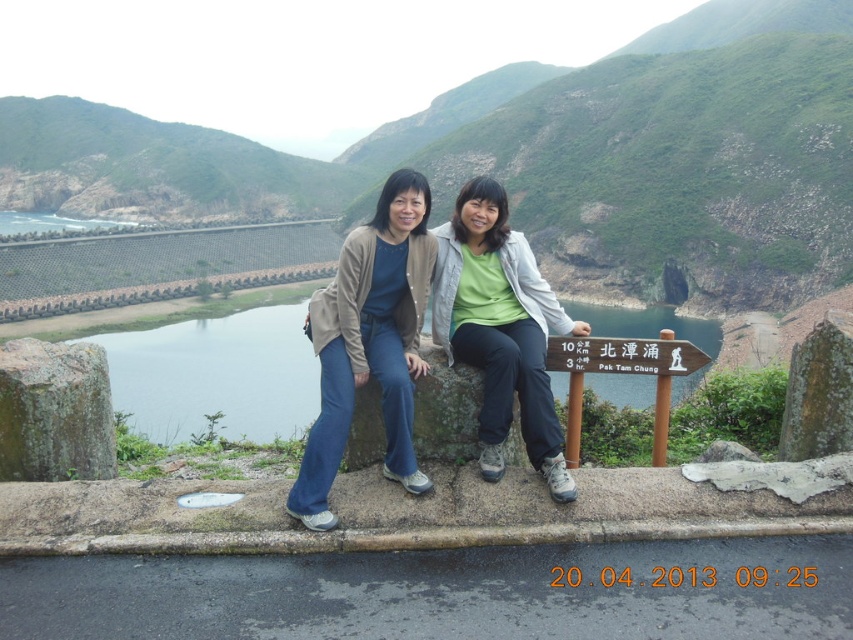
You are standing at the stone ledge where the two people are sitting. You want to throw a rock towards the point marked at coordinates point (418, 243). Can you estimate how far you need to throw the rock to reach that point?

The distance of point (418, 243) from viewer is 15.28 meters, so you need to throw the rock approximately 15.28 meters to reach that point.

You are planning to take a photo of the clear blue water at center and the green fabric jacket at center. Which object occupies more horizontal space in the image?

The clear blue water at center is wider than the green fabric jacket at center, so it occupies more horizontal space in the image.